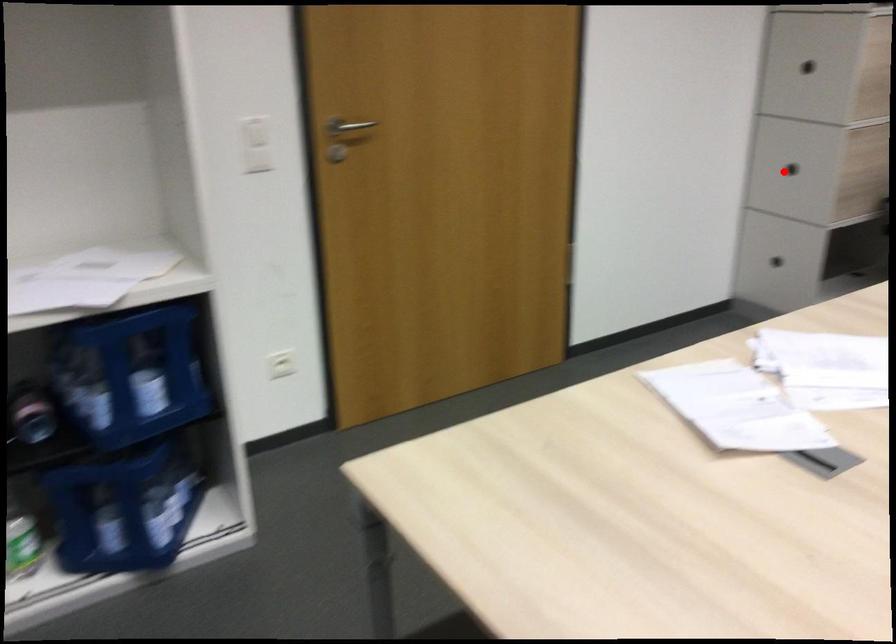
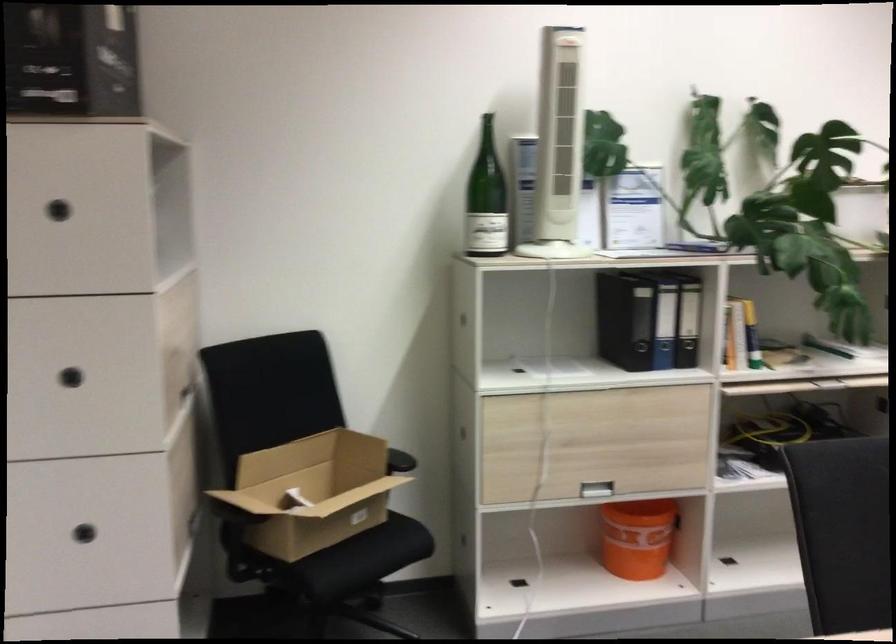
Question: I am providing you with two images of the same scene from different viewpoints. In image1, a red point is highlighted. Considering the same 3D point in image2, which of the following is correct?

Choices:
 (A) It is closer
 (B) It is farther

Answer: (A)